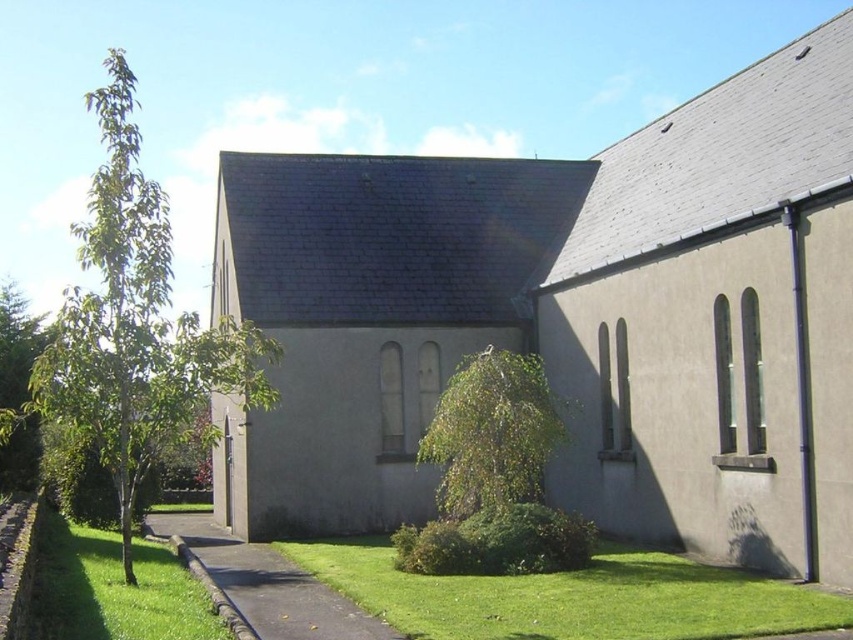
Does point (550, 442) lie in front of point (495, 573)?

No, (550, 442) is behind (495, 573).

Who is positioned more to the right, green leafy tree at center or green leafy bush at center?

green leafy tree at center

Who is more distant from viewer, (485, 483) or (416, 545)?

Positioned behind is point (485, 483).

Find the location of a particular element. This screenshot has height=640, width=853. green leafy tree at center is located at coordinates (491, 433).

Who is more forward, [766,602] or [585,538]?

Point [766,602]

Does green grass at lower center appear on the left side of green leafy bush at center?

In fact, green grass at lower center is to the right of green leafy bush at center.

At what (x,y) coordinates should I click in order to perform the action: click on green grass at lower center. Please return your answer as a coordinate pair (x, y). The image size is (853, 640). Looking at the image, I should click on (572, 596).

You are a GUI agent. You are given a task and a screenshot of the screen. Output one action in this format:
    pyautogui.click(x=<x>, y=<y>)
    Task: Click on the green grass at lower center
    Image resolution: width=853 pixels, height=640 pixels.
    Given the screenshot: What is the action you would take?
    pyautogui.click(x=572, y=596)

Measure the distance between point (671, 568) and camera.

48.23 feet

Does green grass at lower center appear over green grass at lower left?

Yes, green grass at lower center is above green grass at lower left.

Who is more distant from viewer, (433, 616) or (172, 570)?

Point (172, 570)

Identify the location of green grass at lower center. Image resolution: width=853 pixels, height=640 pixels. (572, 596).